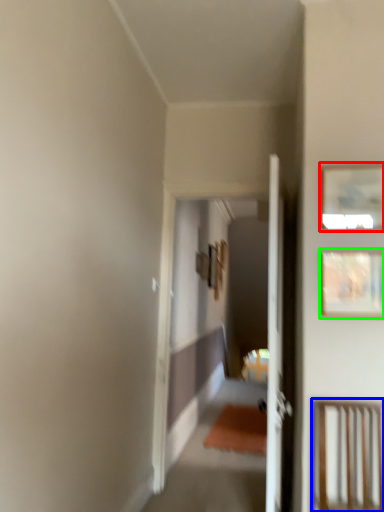
Question: Estimate the real-world distances between objects in this image. Which object is closer to picture frame (highlighted by a red box), furniture (highlighted by a blue box) or picture frame (highlighted by a green box)?

Choices:
 (A) furniture
 (B) picture frame

Answer: (B)